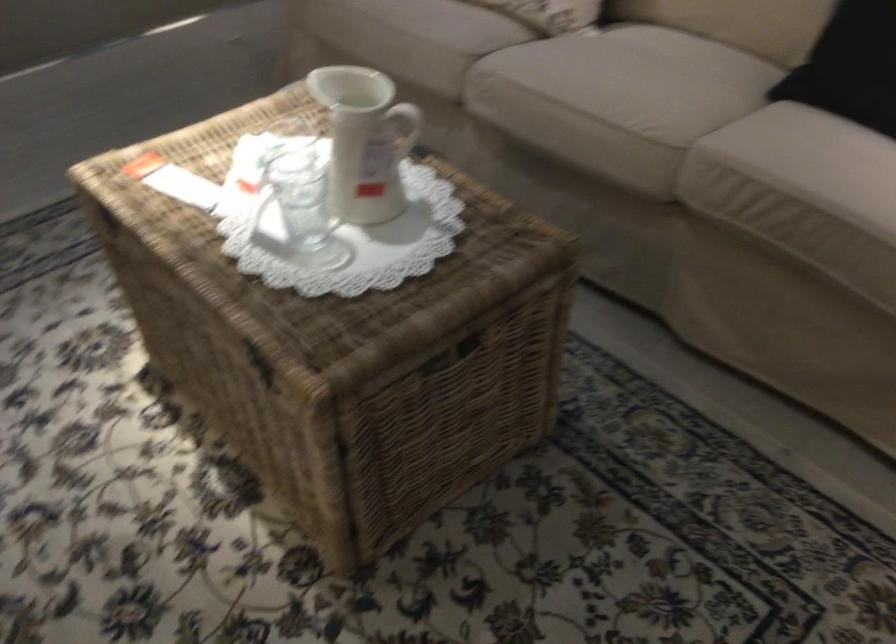
This screenshot has width=896, height=644. I want to click on black trunk latch, so click(x=260, y=364).